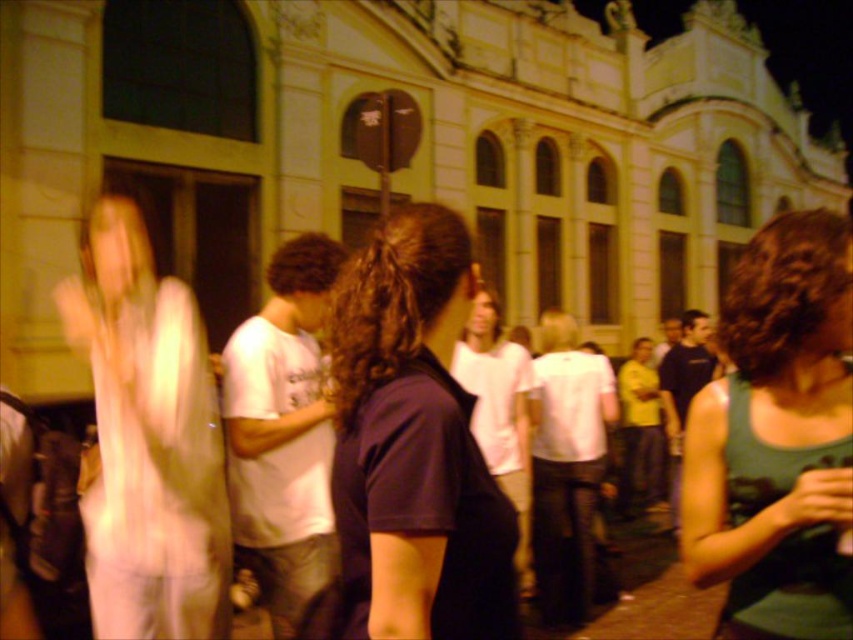
Between green fabric tank top at center and white matte shirt at center, which one has more height?

green fabric tank top at center

Is green fabric tank top at center thinner than white matte shirt at center?

No, green fabric tank top at center is not thinner than white matte shirt at center.

From the picture: Who is more forward, (834, 404) or (538, 324)?

Point (834, 404) is in front.

Locate an element on the screen. The image size is (853, 640). green fabric tank top at center is located at coordinates (776, 440).

Can you confirm if white cotton t-shirt at center is taller than white t-shirt at center?

Correct, white cotton t-shirt at center is much taller as white t-shirt at center.

Which is behind, point (224, 412) or point (679, 323)?

The point (679, 323) is behind.

Where is `white cotton t-shirt at center`? white cotton t-shirt at center is located at coordinates (283, 436).

Is white matte t-shirt at center wider than dark blue t-shirt at center?

No, white matte t-shirt at center is not wider than dark blue t-shirt at center.

Between point (469, 352) and point (706, 339), which one is positioned in front?

Point (469, 352)

Where is `white matte t-shirt at center`? The width and height of the screenshot is (853, 640). white matte t-shirt at center is located at coordinates (498, 412).